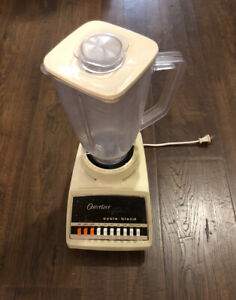
In order to click on handle in this screenshot , I will do `click(172, 65)`.